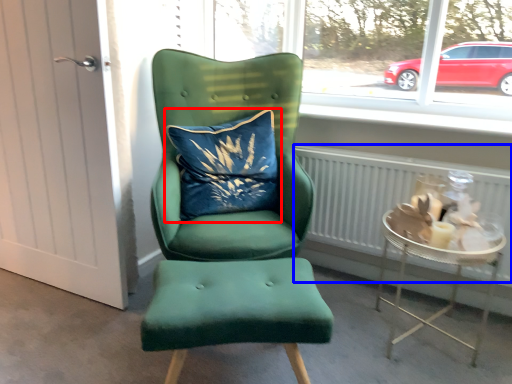
Question: Among these objects, which one is nearest to the camera, pillow (highlighted by a red box) or radiator (highlighted by a blue box)?

Choices:
 (A) pillow
 (B) radiator

Answer: (B)